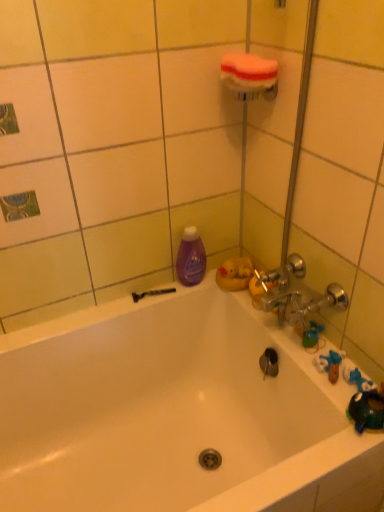
Image resolution: width=384 pixels, height=512 pixels. In order to click on free space on the front side of green rubber toy at right in this screenshot , I will do `click(326, 384)`.